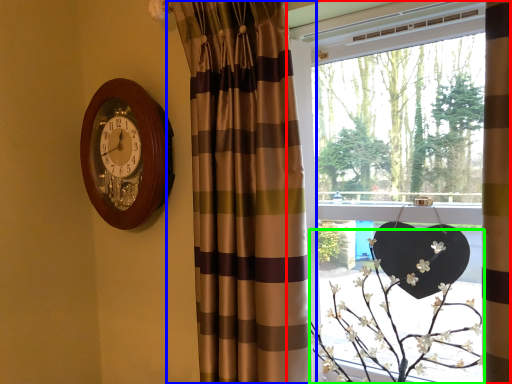
Question: Which object is the closest to the window (highlighted by a red box)? Choose among these: curtain (highlighted by a blue box) or floral arrangement (highlighted by a green box).

Choices:
 (A) curtain
 (B) floral arrangement

Answer: (B)